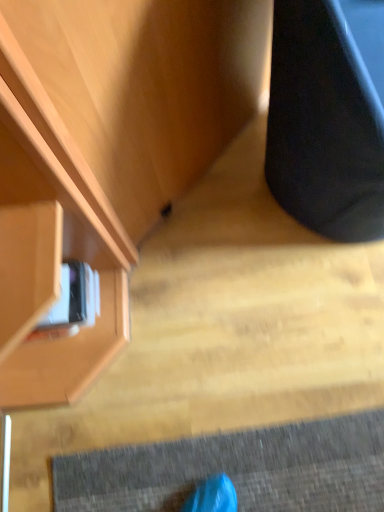
Question: Should I look upward or downward to see black matte speaker at right?

Choices:
 (A) down
 (B) up

Answer: (B)

Question: Is matte wood cabinet at upper left positioned with its back to black matte speaker at right?

Choices:
 (A) no
 (B) yes

Answer: (A)

Question: Is the depth of matte wood cabinet at upper left greater than that of black matte speaker at right?

Choices:
 (A) no
 (B) yes

Answer: (B)

Question: Can you confirm if matte wood cabinet at upper left is wider than black matte speaker at right?

Choices:
 (A) yes
 (B) no

Answer: (A)

Question: Considering the relative positions of matte wood cabinet at upper left and black matte speaker at right in the image provided, is matte wood cabinet at upper left to the right of black matte speaker at right from the viewer's perspective?

Choices:
 (A) no
 (B) yes

Answer: (A)

Question: Is black matte speaker at right a part of matte wood cabinet at upper left?

Choices:
 (A) no
 (B) yes

Answer: (A)

Question: Is matte wood cabinet at upper left far from black matte speaker at right?

Choices:
 (A) no
 (B) yes

Answer: (A)

Question: Can you confirm if black matte speaker at right is positioned to the right of matte wood cabinet at upper left?

Choices:
 (A) yes
 (B) no

Answer: (A)

Question: From the image's perspective, is black matte speaker at right over matte wood cabinet at upper left?

Choices:
 (A) no
 (B) yes

Answer: (B)

Question: Is black matte speaker at right outside matte wood cabinet at upper left?

Choices:
 (A) no
 (B) yes

Answer: (B)

Question: Is black matte speaker at right wider than matte wood cabinet at upper left?

Choices:
 (A) no
 (B) yes

Answer: (A)

Question: From a real-world perspective, is black matte speaker at right physically above matte wood cabinet at upper left?

Choices:
 (A) yes
 (B) no

Answer: (A)

Question: Considering the relative positions of black matte speaker at right and matte wood cabinet at upper left in the image provided, is black matte speaker at right in front of matte wood cabinet at upper left?

Choices:
 (A) yes
 (B) no

Answer: (A)

Question: Based on their positions, is black matte speaker at right located to the left or right of matte wood cabinet at upper left?

Choices:
 (A) left
 (B) right

Answer: (B)